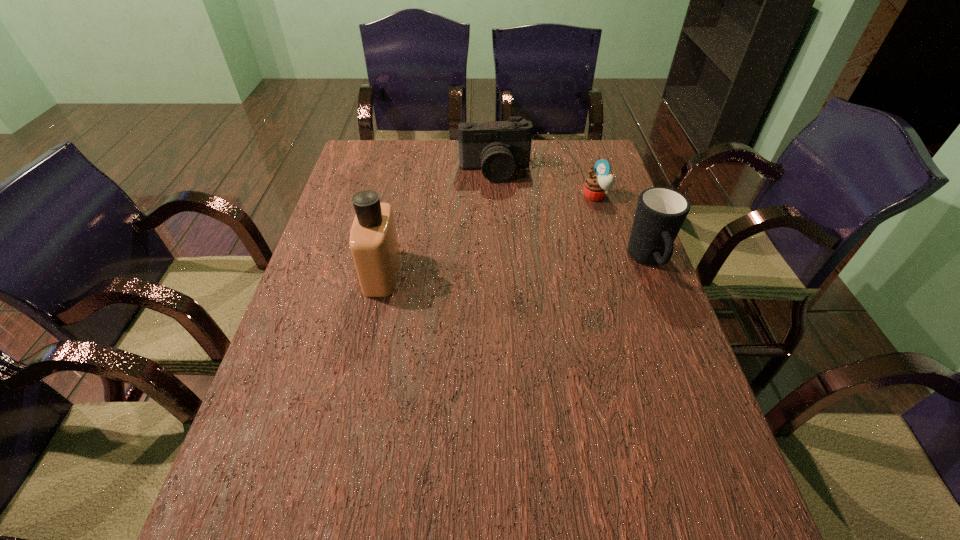
Where is `vacant spot on the desktop that is between the tallest object and the mug and is positioned on the front-facing side of the shortest object`? vacant spot on the desktop that is between the tallest object and the mug and is positioned on the front-facing side of the shortest object is located at coordinates (518, 267).

At what (x,y) coordinates should I click in order to perform the action: click on vacant spot on the desktop that is between the tallest object and the mug and is positioned at the lens of the camera. Please return your answer as a coordinate pair (x, y). Image resolution: width=960 pixels, height=540 pixels. Looking at the image, I should click on (512, 267).